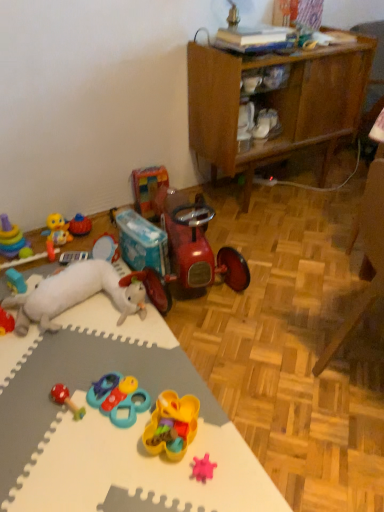
The height and width of the screenshot is (512, 384). I want to click on free space that is in between rubberized red and green toy at lower left, the 6th toy positioned from the right, and rubber teething ring at lower left, the 3th toy in the left-to-right sequence, so click(48, 354).